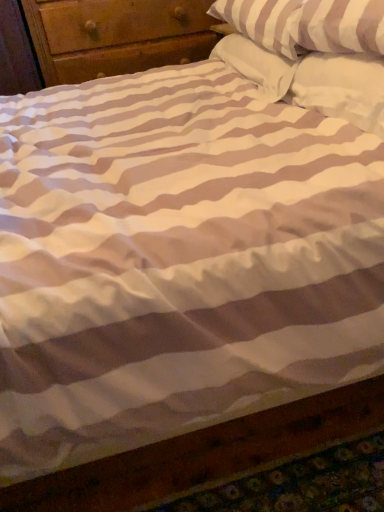
Question: Which is correct: white soft pillow at upper right, which is the 1th pillow from back to front, is inside white striped pillow at upper right, the 2th pillow viewed from the front, or outside of it?

Choices:
 (A) outside
 (B) inside

Answer: (A)

Question: From the image's perspective, is white soft pillow at upper right, which is the 1th pillow from back to front, positioned above or below white striped pillow at upper right, which is counted as the second pillow, starting from the back?

Choices:
 (A) below
 (B) above

Answer: (A)

Question: Estimate the real-world distances between objects in this image. Which object is closer to the white soft pillow at upper right, the first pillow when ordered from front to back?

Choices:
 (A) white soft pillow at upper right, the 3th pillow viewed from the front
 (B) white striped pillow at upper right, the 2th pillow viewed from the front

Answer: (A)

Question: Estimate the real-world distances between objects in this image. Which object is closer to the white soft pillow at upper right, which is the 1th pillow from back to front?

Choices:
 (A) white striped pillow at upper right, which is counted as the second pillow, starting from the back
 (B) white soft pillow at upper right, the first pillow when ordered from front to back

Answer: (B)